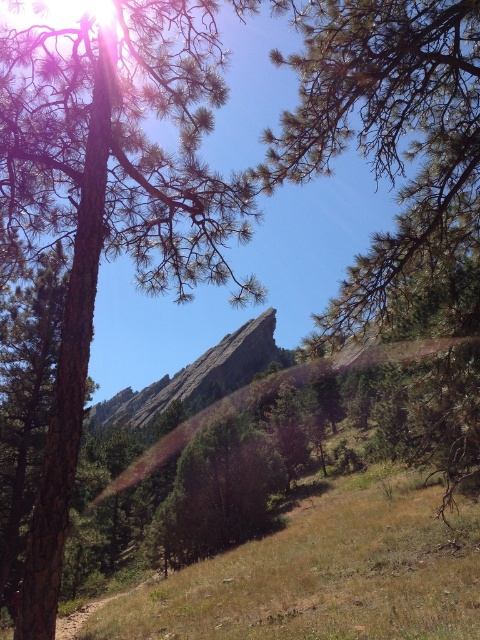
You are standing at the center of the image and want to locate the green rough bark tree at upper left. According to the coordinates provided, in which direction should you look to find it?

The green rough bark tree at upper left is located at point [110,202], which is to the upper left direction from your current position at the center.

You are standing at the center of the image and see the green textured pine tree at center and the smooth gray rock at center. Which object is closer to your right side?

The green textured pine tree at center is to the right of the smooth gray rock at center, so it is closer to your right side.